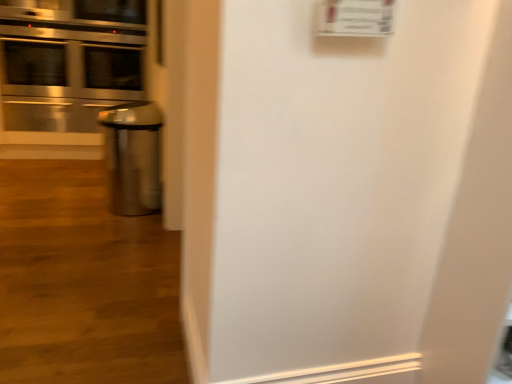
At what (x,y) coordinates should I click in order to perform the action: click on vacant space in front of shiny metallic trash can at center. Please return your answer as a coordinate pair (x, y). Looking at the image, I should click on (111, 230).